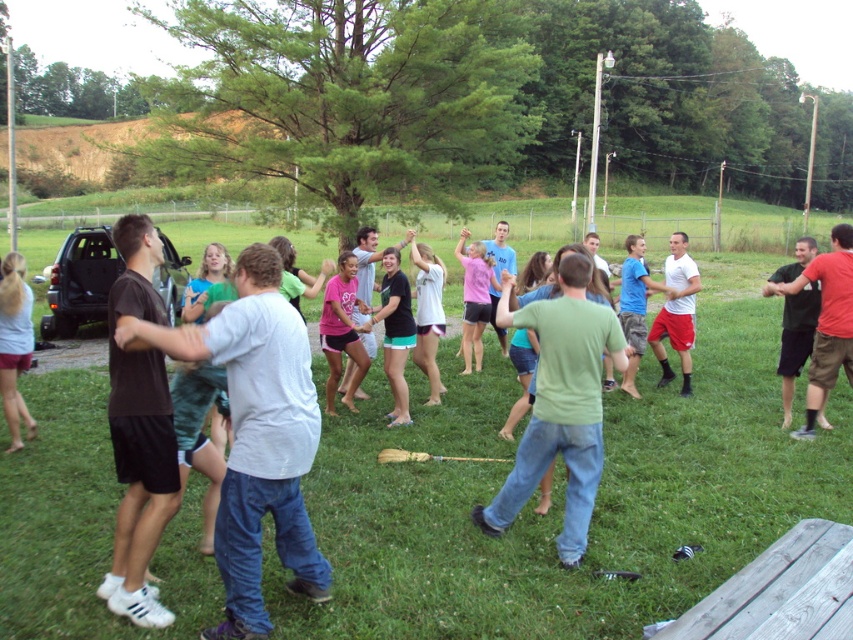
You are part of a group standing in a circle holding hands. You notice two people wearing a green matte shirt at center and a pink matte shirt at center. The group leader asks if the distance between these two shirts is sufficient to fit a 15 feet long banner between them. Can you confirm?

The distance between the green matte shirt at center and the pink matte shirt at center is 18.21 feet, which is greater than the 15 feet length of the banner. Therefore, the banner can fit between them.